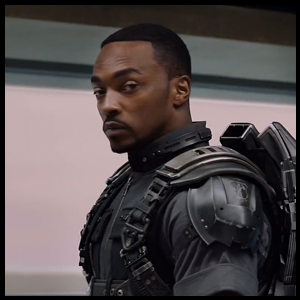
This screenshot has width=300, height=300. Find the location of `pink wall`. pink wall is located at coordinates (40, 197).